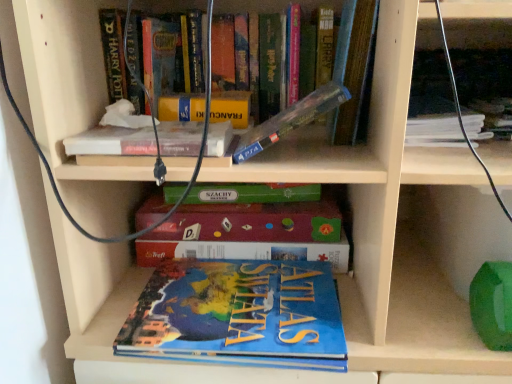
Question: From a real-world perspective, does hardcover book at upper center, positioned as the sixth book in bottom-to-top order, stand above yellow matte book at upper center?

Choices:
 (A) yes
 (B) no

Answer: (A)

Question: Can you confirm if hardcover book at upper center, arranged as the first book when viewed from the top, is smaller than yellow matte book at upper center?

Choices:
 (A) no
 (B) yes

Answer: (A)

Question: Is hardcover book at upper center, arranged as the first book when viewed from the top, located outside yellow matte book at upper center?

Choices:
 (A) no
 (B) yes

Answer: (B)

Question: Is hardcover book at upper center, arranged as the first book when viewed from the top, at the right side of yellow matte book at upper center?

Choices:
 (A) no
 (B) yes

Answer: (B)

Question: Are hardcover book at upper center, arranged as the first book when viewed from the top, and yellow matte book at upper center far apart?

Choices:
 (A) no
 (B) yes

Answer: (A)

Question: Is hardcover book at upper right, which is the 2th book from top to bottom, taller or shorter than clear plastic case at upper center, the fourth book positioned from the bottom?

Choices:
 (A) short
 (B) tall

Answer: (A)

Question: From the image's perspective, is hardcover book at upper right, which is the 2th book from top to bottom, above or below clear plastic case at upper center, marked as the third book in a top-to-bottom arrangement?

Choices:
 (A) below
 (B) above

Answer: (B)

Question: In terms of size, does hardcover book at upper right, which is the 2th book from top to bottom, appear bigger or smaller than clear plastic case at upper center, marked as the third book in a top-to-bottom arrangement?

Choices:
 (A) big
 (B) small

Answer: (B)

Question: In the image, is hardcover book at upper right, which is the 2th book from top to bottom, positioned in front of or behind clear plastic case at upper center, marked as the third book in a top-to-bottom arrangement?

Choices:
 (A) front
 (B) behind

Answer: (B)

Question: Is hardcover book at upper center, positioned as the sixth book in bottom-to-top order, situated inside clear plastic case at upper center, marked as the third book in a top-to-bottom arrangement, or outside?

Choices:
 (A) inside
 (B) outside

Answer: (B)

Question: Is point (354, 132) closer or farther from the camera than point (310, 112)?

Choices:
 (A) closer
 (B) farther

Answer: (B)

Question: Considering the positions of hardcover book at upper center, positioned as the sixth book in bottom-to-top order, and clear plastic case at upper center, marked as the third book in a top-to-bottom arrangement, in the image, is hardcover book at upper center, positioned as the sixth book in bottom-to-top order, taller or shorter than clear plastic case at upper center, marked as the third book in a top-to-bottom arrangement,?

Choices:
 (A) short
 (B) tall

Answer: (B)

Question: From a real-world perspective, is hardcover book at upper center, positioned as the sixth book in bottom-to-top order, physically located above or below clear plastic case at upper center, the fourth book positioned from the bottom?

Choices:
 (A) above
 (B) below

Answer: (A)

Question: Is clear plastic case at upper center, marked as the third book in a top-to-bottom arrangement, to the left or to the right of blue matte atlas of the world at lower center, which is the 1th book from bottom to top, in the image?

Choices:
 (A) right
 (B) left

Answer: (A)

Question: Is clear plastic case at upper center, marked as the third book in a top-to-bottom arrangement, wider or thinner than blue matte atlas of the world at lower center, arranged as the 6th book when viewed from the top?

Choices:
 (A) wide
 (B) thin

Answer: (B)